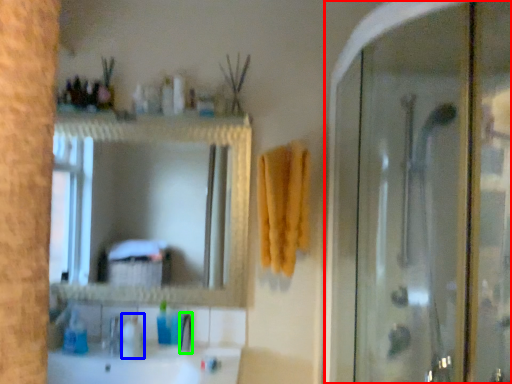
Question: Which is nearer to the screen door (highlighted by a red box)? toiletry (highlighted by a blue box) or faucet (highlighted by a green box).

Choices:
 (A) toiletry
 (B) faucet

Answer: (B)